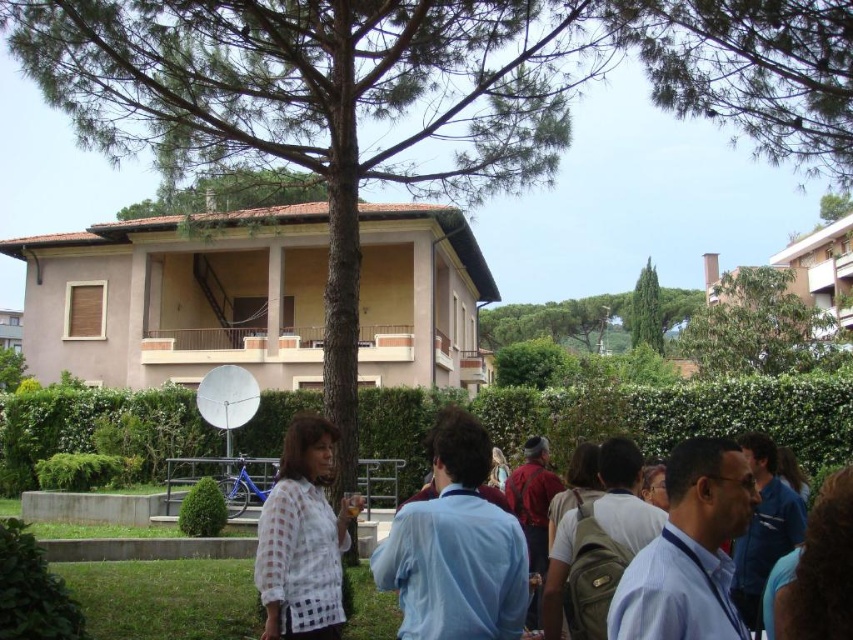
Between white sheer blouse at center and green leafy tree at upper right, which one appears on the left side from the viewer's perspective?

white sheer blouse at center

Between white sheer blouse at center and green leafy tree at upper right, which one is positioned lower?

Positioned lower is white sheer blouse at center.

Between point (279, 532) and point (743, 356), which one is positioned in front?

Point (279, 532) is in front.

At what (x,y) coordinates should I click in order to perform the action: click on white sheer blouse at center. Please return your answer as a coordinate pair (x, y). The image size is (853, 640). Looking at the image, I should click on (302, 538).

Find the location of a particular element. The width and height of the screenshot is (853, 640). green leafy tree at upper center is located at coordinates (230, 193).

Can you confirm if green leafy tree at upper center is thinner than green textured tree at center?

No.

Identify the location of green leafy tree at upper center. The height and width of the screenshot is (640, 853). (230, 193).

Can you confirm if white sheer blouse at center is thinner than green leafy tree at upper center?

Yes, white sheer blouse at center is thinner than green leafy tree at upper center.

Is white sheer blouse at center above green leafy tree at upper center?

Incorrect, white sheer blouse at center is not positioned above green leafy tree at upper center.

Is point (299, 589) positioned in front of point (283, 177)?

That is True.

Where is `white sheer blouse at center`? The image size is (853, 640). white sheer blouse at center is located at coordinates (302, 538).